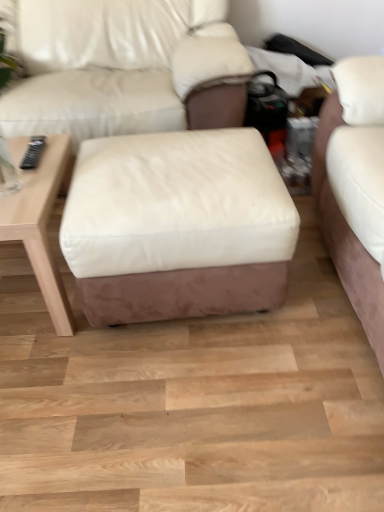
Find the location of a particular element. This screenshot has height=512, width=384. empty space that is in between white leather ottoman at center and wooden table at left is located at coordinates (52, 336).